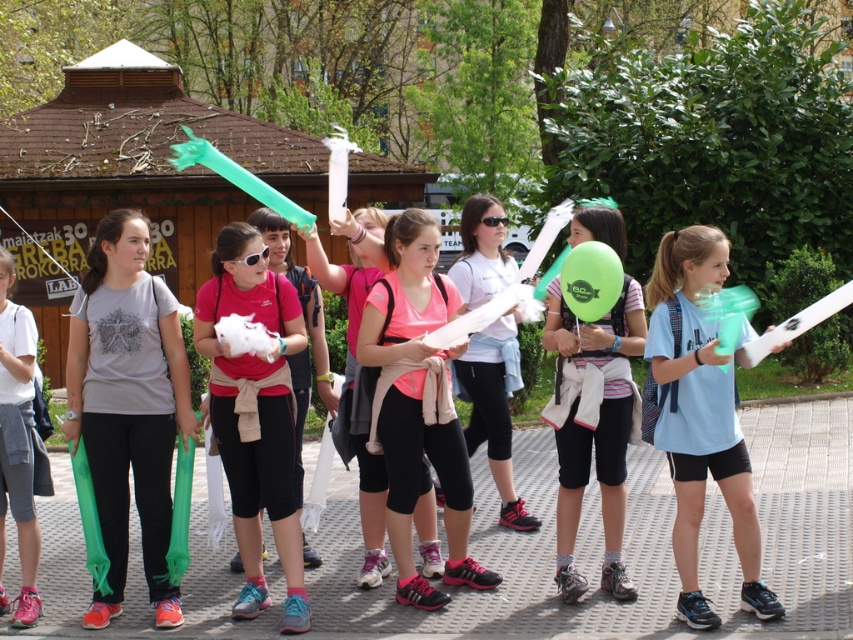
In the scene shown: Is light blue fabric balloon at center positioned at the back of matte white balloon at center?

No.

Can you confirm if light blue fabric balloon at center is wider than matte white balloon at center?

Yes.

This screenshot has height=640, width=853. What are the coordinates of `light blue fabric balloon at center` in the screenshot? It's located at (699, 417).

At what (x,y) coordinates should I click in order to perform the action: click on light blue fabric balloon at center. Please return your answer as a coordinate pair (x, y). The width and height of the screenshot is (853, 640). Looking at the image, I should click on (699, 417).

Does point (241, 416) come behind point (479, 396)?

That is False.

Consider the image. Is matte pink shirt at center in front of matte white balloon at center?

Yes, it is.

Does point (274, 477) come in front of point (495, 253)?

Yes, point (274, 477) is closer to viewer.

I want to click on matte pink shirt at center, so click(254, 413).

Does light blue fabric balloon at center appear on the left side of matte pink shirt at center?

Incorrect, light blue fabric balloon at center is not on the left side of matte pink shirt at center.

Is point (718, 358) more distant than point (241, 426)?

No.

This screenshot has height=640, width=853. What do you see at coordinates (699, 417) in the screenshot? I see `light blue fabric balloon at center` at bounding box center [699, 417].

I want to click on light blue fabric balloon at center, so click(x=699, y=417).